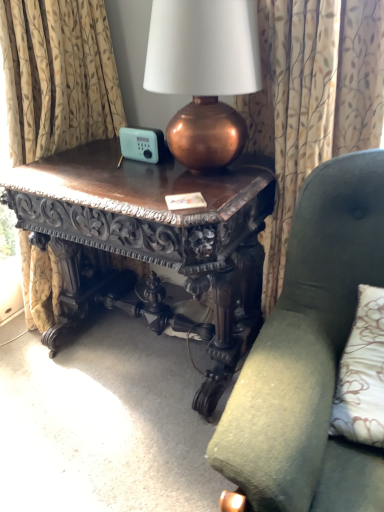
Locate an element on the screen. The image size is (384, 512). free space that is to the left of copper metallic lamp at upper center is located at coordinates (124, 172).